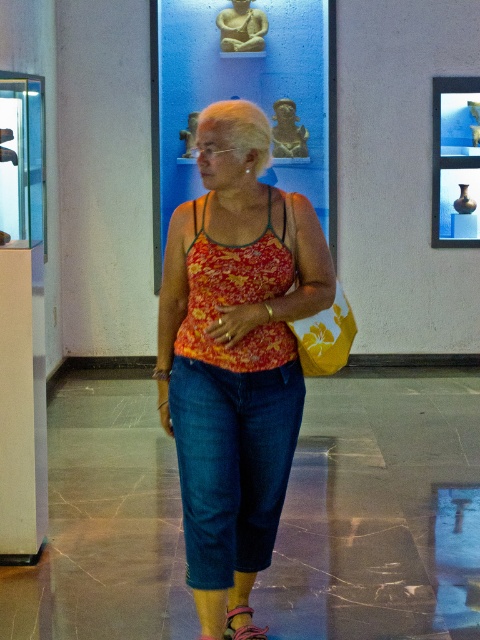
Question: Can you confirm if floral fabric tank top at center is wider than leather sandal at lower center?

Choices:
 (A) yes
 (B) no

Answer: (A)

Question: Which point is closer to the camera?

Choices:
 (A) leather sandal at lower center
 (B) floral fabric tank top at center

Answer: (B)

Question: Can you confirm if floral fabric tank top at center is positioned to the right of leather sandal at lower center?

Choices:
 (A) no
 (B) yes

Answer: (A)

Question: Among these points, which one is nearest to the camera?

Choices:
 (A) (249, 340)
 (B) (240, 611)

Answer: (A)

Question: Is floral fabric tank top at center behind leather sandal at lower center?

Choices:
 (A) yes
 (B) no

Answer: (B)